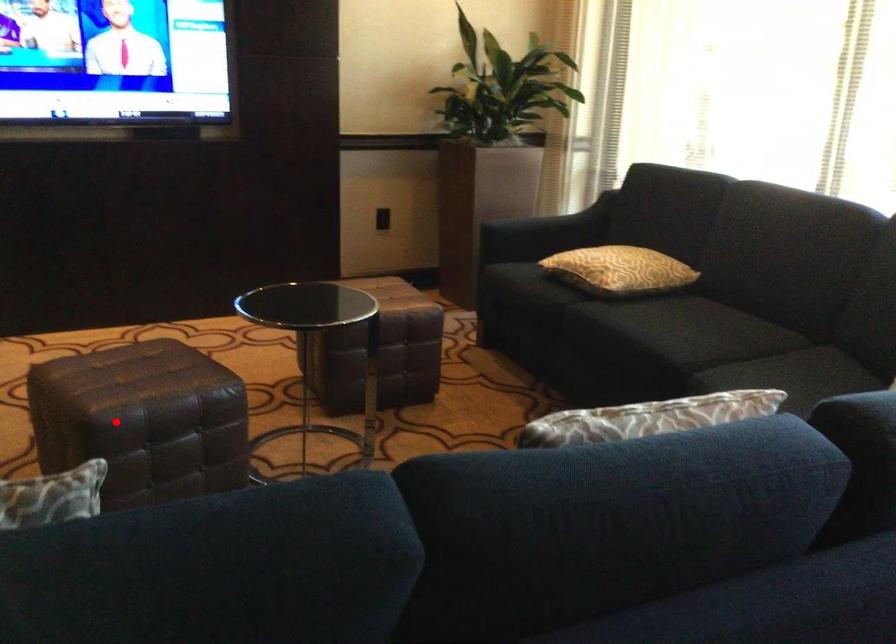
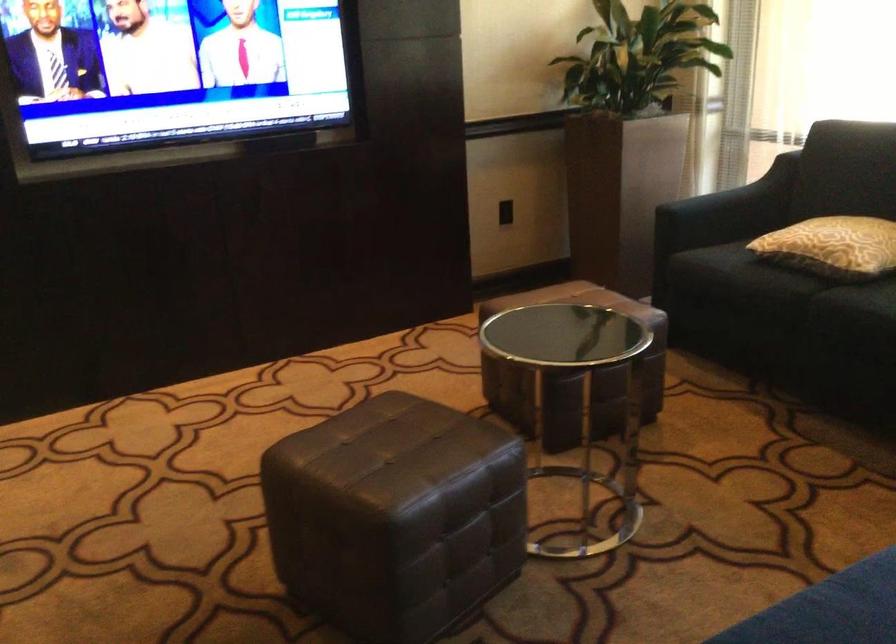
Question: I am providing you with two images of the same scene from different viewpoints. Given a red point in image1, look at the same physical point in image2. Is it:

Choices:
 (A) Closer to the viewpoint
 (B) Farther from the viewpoint

Answer: (A)